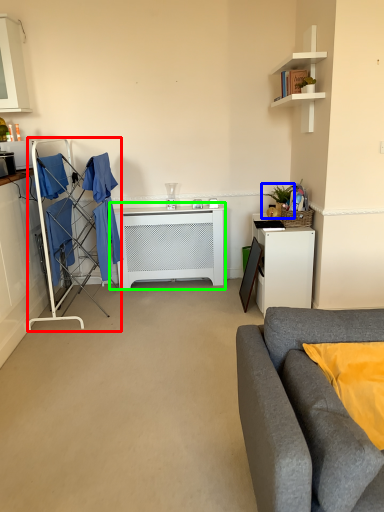
Question: Which is nearer to the closet (highlighted by a red box)? houseplant (highlighted by a blue box) or table (highlighted by a green box).

Choices:
 (A) houseplant
 (B) table

Answer: (B)